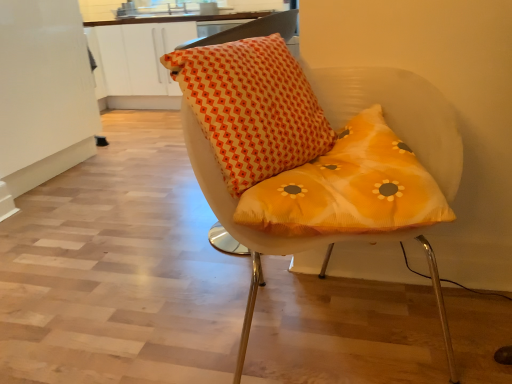
Describe the element at coordinates (252, 107) in the screenshot. I see `orange printed cushion at center` at that location.

You are a GUI agent. You are given a task and a screenshot of the screen. Output one action in this format:
    pyautogui.click(x=<x>, y=<y>)
    Task: Click on the orange printed cushion at center
    This screenshot has height=384, width=512.
    Given the screenshot: What is the action you would take?
    pyautogui.click(x=252, y=107)

What is the approximate height of orange printed cushion at center?

19.93 inches.

Identify the location of matte orange cushion at center. (326, 180).

What do you see at coordinates (326, 180) in the screenshot?
I see `matte orange cushion at center` at bounding box center [326, 180].

In the scene shown: What is the approximate width of matte orange cushion at center?

matte orange cushion at center is 31.35 inches wide.

Where is `orange printed cushion at center`? Image resolution: width=512 pixels, height=384 pixels. orange printed cushion at center is located at coordinates (252, 107).

Considering the positions of objects orange printed cushion at center and matte orange cushion at center in the image provided, who is more to the right, orange printed cushion at center or matte orange cushion at center?

Positioned to the right is matte orange cushion at center.

Considering the relative positions of orange printed cushion at center and matte orange cushion at center in the image provided, is orange printed cushion at center behind matte orange cushion at center?

Yes.

Is point (297, 118) positioned before point (396, 106)?

Yes.

Based on the photo, from the image's perspective, between orange printed cushion at center and matte orange cushion at center, which one is located above?

orange printed cushion at center, from the image's perspective.

From a real-world perspective, relative to matte orange cushion at center, is orange printed cushion at center vertically above or below?

In terms of real-world spatial position, orange printed cushion at center is above matte orange cushion at center.

Which of these two, orange printed cushion at center or matte orange cushion at center, is wider?

matte orange cushion at center.

Based on the photo, between orange printed cushion at center and matte orange cushion at center, which one has more height?

matte orange cushion at center.

Considering the relative sizes of orange printed cushion at center and matte orange cushion at center in the image provided, is orange printed cushion at center bigger than matte orange cushion at center?

No, orange printed cushion at center is not bigger than matte orange cushion at center.

Is orange printed cushion at center positioned beyond the bounds of matte orange cushion at center?

No, orange printed cushion at center is inside matte orange cushion at center's boundary.

Is orange printed cushion at center next to matte orange cushion at center and touching it?

Yes.

Does orange printed cushion at center turn towards matte orange cushion at center?

Yes.

How many degrees apart are the facing directions of orange printed cushion at center and matte orange cushion at center?

33 degrees.

Find the location of `pillow located above the matte orange cushion at center (from the image's perspective)`. pillow located above the matte orange cushion at center (from the image's perspective) is located at coordinates (252, 107).

From the picture: Which object is positioned more to the right, matte orange cushion at center or orange printed cushion at center?

From the viewer's perspective, matte orange cushion at center appears more on the right side.

Does matte orange cushion at center come behind orange printed cushion at center?

No, the depth of matte orange cushion at center is less than that of orange printed cushion at center.

Considering the points (368, 85) and (243, 177), which point is behind, point (368, 85) or point (243, 177)?

Positioned behind is point (368, 85).

From the image's perspective, which is below, matte orange cushion at center or orange printed cushion at center?

matte orange cushion at center is shown below in the image.

From a real-world perspective, relative to orange printed cushion at center, is matte orange cushion at center vertically above or below?

matte orange cushion at center is situated lower than orange printed cushion at center in the real world.

Can you confirm if matte orange cushion at center is thinner than orange printed cushion at center?

Incorrect, the width of matte orange cushion at center is not less than that of orange printed cushion at center.

Between matte orange cushion at center and orange printed cushion at center, which one has more height?

matte orange cushion at center is taller.

From the picture: Who is bigger, matte orange cushion at center or orange printed cushion at center?

matte orange cushion at center is bigger.

Is matte orange cushion at center outside of orange printed cushion at center?

Indeed, matte orange cushion at center is completely outside orange printed cushion at center.

Would you say matte orange cushion at center is a long distance from orange printed cushion at center?

They are positioned close to each other.

Is orange printed cushion at center at the back of matte orange cushion at center?

No, matte orange cushion at center's orientation is not away from orange printed cushion at center.

You are a GUI agent. You are given a task and a screenshot of the screen. Output one action in this format:
    pyautogui.click(x=<x>, y=<y>)
    Task: Click on the chair on the right of orange printed cushion at center
    The image size is (512, 384).
    Given the screenshot: What is the action you would take?
    pyautogui.click(x=326, y=180)

Where is `chair located underneath the orange printed cushion at center (from a real-world perspective)`? Image resolution: width=512 pixels, height=384 pixels. chair located underneath the orange printed cushion at center (from a real-world perspective) is located at coordinates (326, 180).

Identify the location of pillow above the matte orange cushion at center (from a real-world perspective). (252, 107).